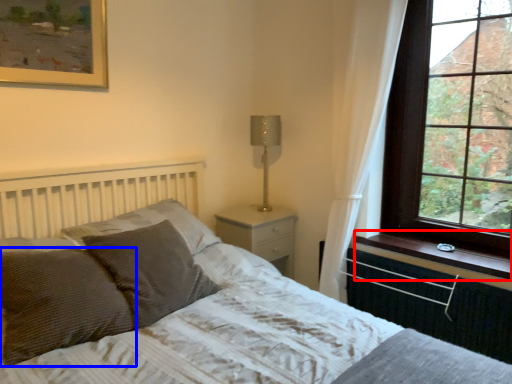
Question: Which of the following is the farthest to the observer, window sill (highlighted by a red box) or pillow (highlighted by a blue box)?

Choices:
 (A) window sill
 (B) pillow

Answer: (A)